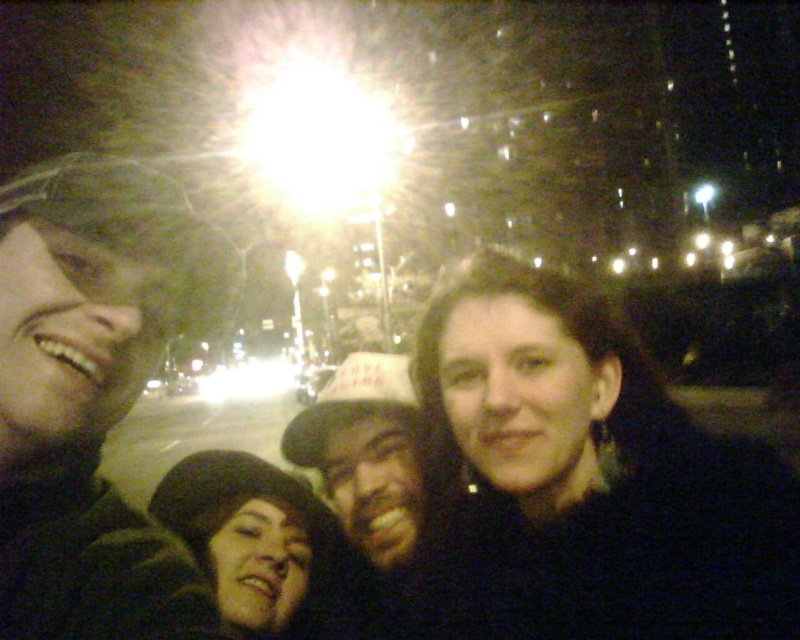
You are a photographer trying to adjust the focus of your camera. You want to focus on the dark brown leather hat at center and the dark brown fur hat at lower left. Which hat should you focus on first to ensure both are in focus, considering their positions?

The dark brown leather hat at center is located above the dark brown fur hat at lower left, so you should focus on the dark brown leather hat at center first as it is closer to the camera. This will ensure both hats remain in focus when using depth of field properly.